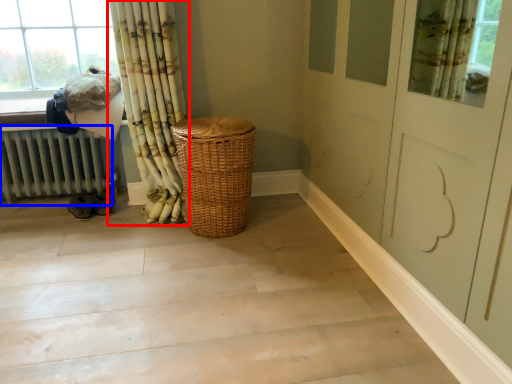
Question: Among these objects, which one is nearest to the camera, curtain (highlighted by a red box) or radiator (highlighted by a blue box)?

Choices:
 (A) curtain
 (B) radiator

Answer: (A)